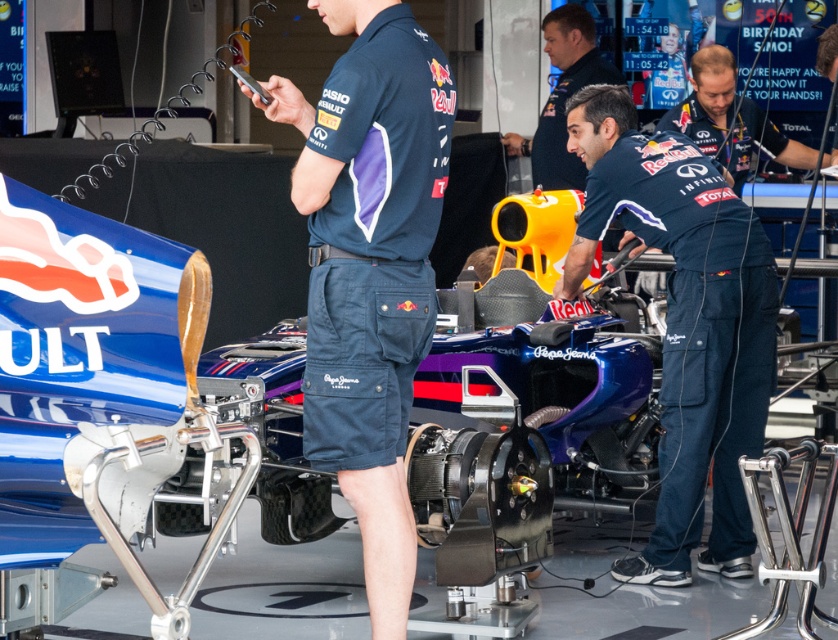
Does navy blue shorts at center appear on the left side of dark blue uniform at center?

Indeed, navy blue shorts at center is positioned on the left side of dark blue uniform at center.

Which is more to the left, navy blue shorts at center or dark blue uniform at center?

navy blue shorts at center

Describe the element at coordinates (370, 268) in the screenshot. This screenshot has width=838, height=640. I see `navy blue shorts at center` at that location.

The width and height of the screenshot is (838, 640). Find the location of `navy blue shorts at center`. navy blue shorts at center is located at coordinates (370, 268).

Consider the image. Between dark blue uniform at center and matte blue uniform at center, which one is positioned lower?

dark blue uniform at center is below.

The width and height of the screenshot is (838, 640). In order to click on dark blue uniform at center in this screenshot , I will do `click(728, 120)`.

Is blue carbon fiber race car at center positioned in front of navy blue shorts at center?

Yes.

Does blue carbon fiber race car at center appear over navy blue shorts at center?

No, blue carbon fiber race car at center is not above navy blue shorts at center.

In order to click on blue carbon fiber race car at center in this screenshot , I will do `click(110, 408)`.

This screenshot has width=838, height=640. Identify the location of blue carbon fiber race car at center. (110, 408).